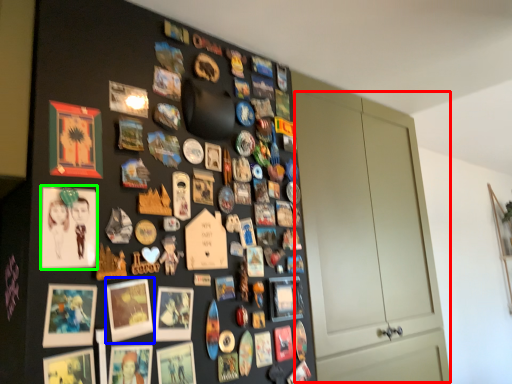
Question: Which object is positioned closest to door (highlighted by a red box)? Select from picture frame (highlighted by a blue box) and picture frame (highlighted by a green box).

Choices:
 (A) picture frame
 (B) picture frame

Answer: (A)